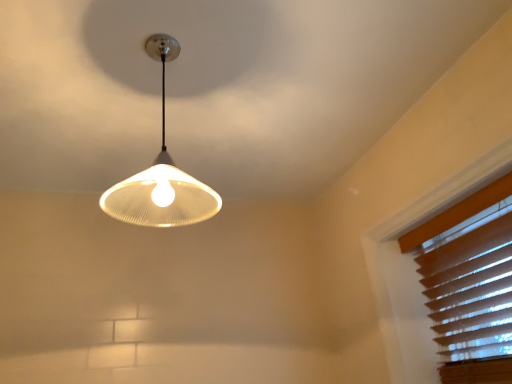
Question: Is white matte lampshade at upper center bigger or smaller than brown wood blinds at upper right?

Choices:
 (A) small
 (B) big

Answer: (B)

Question: Considering the positions of white matte lampshade at upper center and brown wood blinds at upper right in the image, is white matte lampshade at upper center wider or thinner than brown wood blinds at upper right?

Choices:
 (A) wide
 (B) thin

Answer: (A)

Question: Is white matte lampshade at upper center situated inside brown wood blinds at upper right or outside?

Choices:
 (A) outside
 (B) inside

Answer: (A)

Question: Is brown wood blinds at upper right inside or outside of white matte lampshade at upper center?

Choices:
 (A) outside
 (B) inside

Answer: (A)

Question: Is brown wood blinds at upper right bigger or smaller than white matte lampshade at upper center?

Choices:
 (A) big
 (B) small

Answer: (B)

Question: From the image's perspective, is brown wood blinds at upper right located above or below white matte lampshade at upper center?

Choices:
 (A) below
 (B) above

Answer: (A)

Question: Relative to white matte lampshade at upper center, is brown wood blinds at upper right in front or behind?

Choices:
 (A) front
 (B) behind

Answer: (B)